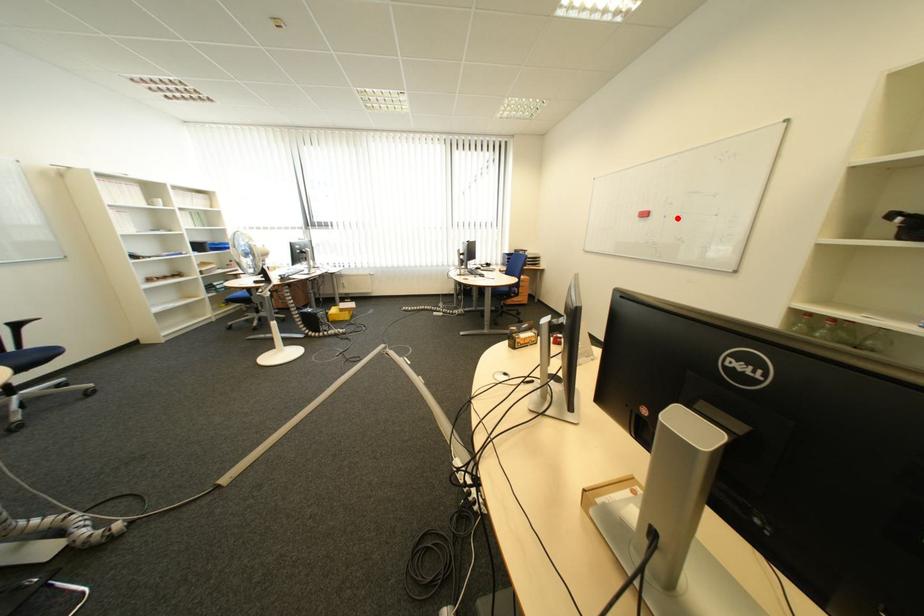
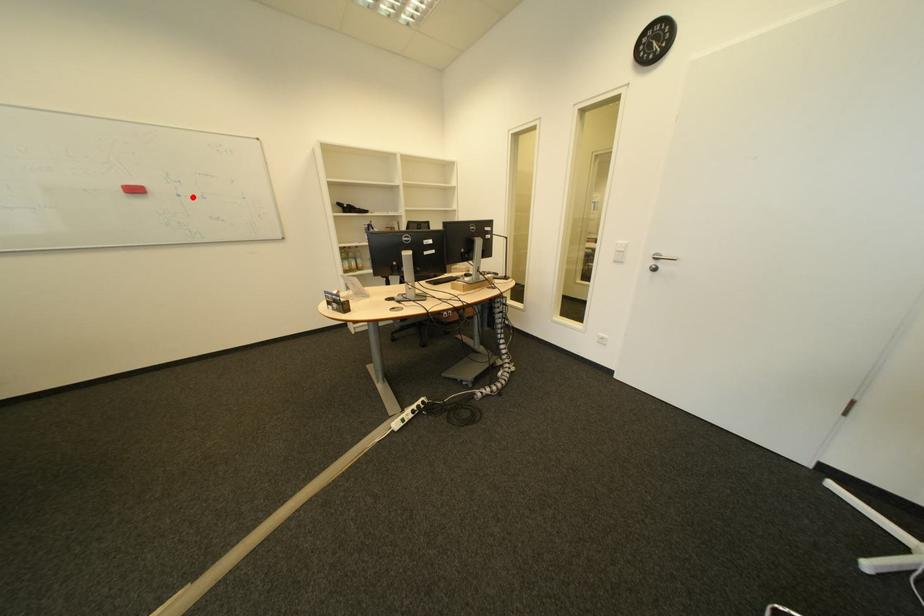
I am providing you with two images of the same scene from different viewpoints. A red point is marked on the first image and another point is marked on the second image. Does the point marked in image1 correspond to the same location as the one in image2?

Yes